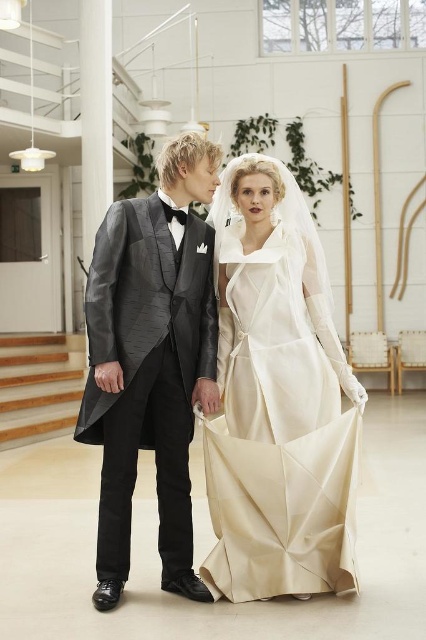
Looking at this image, you are a photographer positioned at the entrance of the room. You need to capture a shot of the ivory satin dress at center. Given that the dress is at coordinates point 0.625, 0.653, where should you position your camera to ensure the dress is the main focus of the image?

The ivory satin dress at center is located at point (278, 400), so positioning the camera at a central angle facing towards those coordinates will ensure the dress is the main focus.

You are a photographer positioned at the back of the room. You want to capture a closeup of the shiny black tuxedo at center without the ivory satin dress at center blocking the view. Is this possible?

The ivory satin dress at center is further to the viewer than the shiny black tuxedo at center. Therefore, the ivory satin dress at center would block the view of the shiny black tuxedo at center, making it impossible to capture a closeup without obstruction.

You are a photographer at the wedding and need to capture a full body shot of both the ivory satin dress at center and the shiny black tuxedo at center. Considering their lengths, which one might require you to adjust your camera angle to ensure the entire outfit is visible?

The ivory satin dress at center is shorter than the shiny black tuxedo at center. Since the dress is shorter, you might need to adjust the camera angle to focus on the upper body to ensure the entire outfit is visible, while the tuxedo, being longer, would naturally allow for a full body shot without angle adjustments.